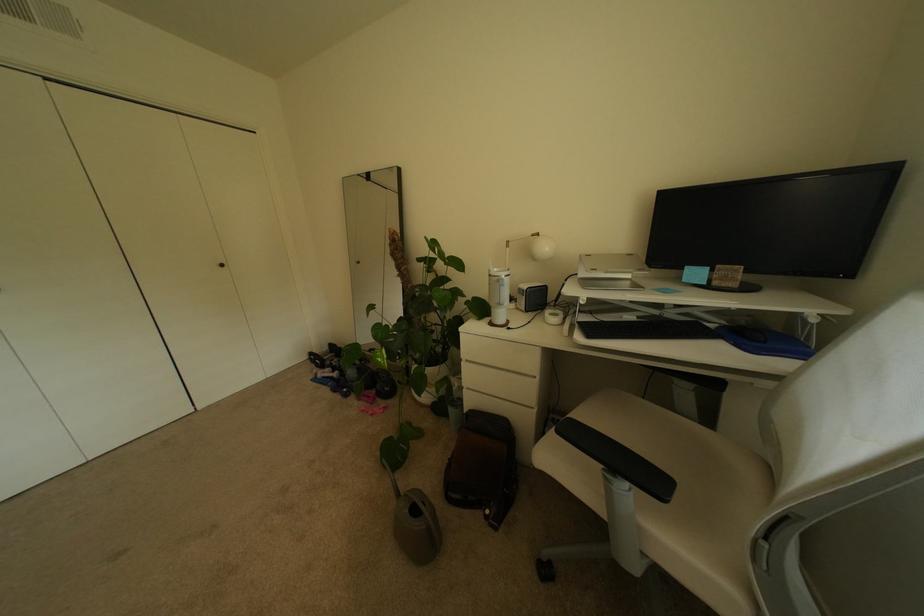
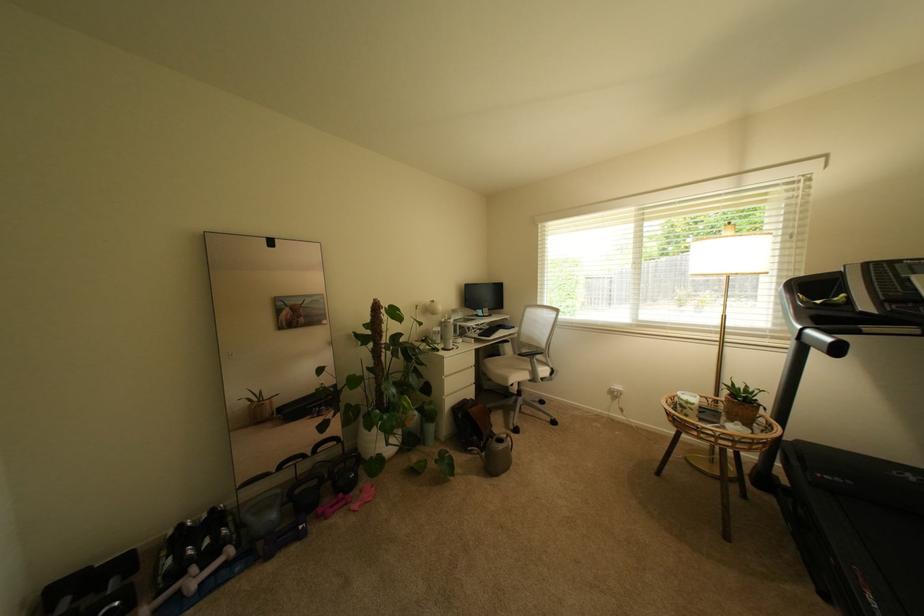
The point at (387, 400) is marked in the first image. Where is the corresponding point in the second image?

(359, 495)